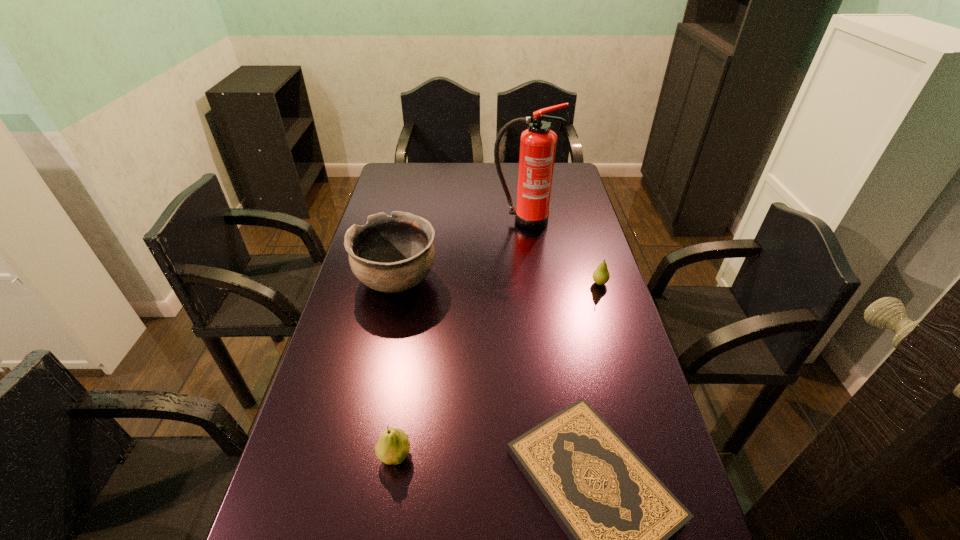
The width and height of the screenshot is (960, 540). Identify the location of free spot between the fourth shortest object and the tallest object. (460, 251).

Locate which object is the closest to the tallest object. Please provide its 2D coordinates. Your answer should be formatted as a tuple, i.e. [(x, y)], where the tuple contains the x and y coordinates of a point satisfying the conditions above.

[(390, 254)]

Locate an element on the screen. Image resolution: width=960 pixels, height=540 pixels. the closest object to the farthest object is located at coordinates (390, 254).

Identify the location of vacant area that satisfies the following two spatial constraints: 1. on the front side of the nearer pear; 2. on the left side of the pottery. The image size is (960, 540). (359, 456).

Where is `vacant space that satisfies the following two spatial constraints: 1. at the nozzle of the farthest object; 2. on the right side of the right pear`? Image resolution: width=960 pixels, height=540 pixels. vacant space that satisfies the following two spatial constraints: 1. at the nozzle of the farthest object; 2. on the right side of the right pear is located at coordinates [532, 283].

This screenshot has height=540, width=960. I want to click on free space that satisfies the following two spatial constraints: 1. at the nozzle of the farthest object; 2. on the left side of the farther pear, so point(532,283).

The width and height of the screenshot is (960, 540). I want to click on free space that satisfies the following two spatial constraints: 1. on the back side of the nearer pear; 2. on the right side of the farther pear, so click(x=420, y=283).